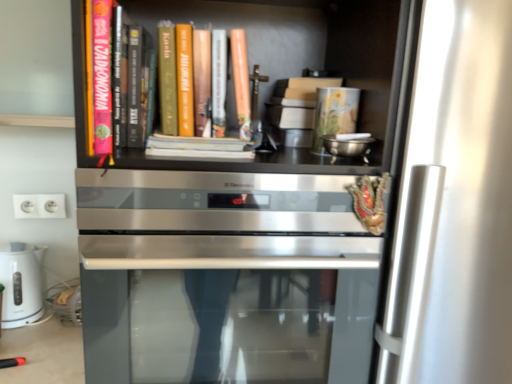
Measure the distance between point (9, 266) and camera.

The depth of point (9, 266) is 3.98 feet.

Describe the element at coordinates (224, 277) in the screenshot. I see `satin silver oven at center` at that location.

What is the approximate width of satin silver oven at center?

satin silver oven at center is 24.40 inches in width.

Find the location of a particular element. Image resolution: width=512 pixels, height=384 pixels. white plastic electrical outlet at lower left is located at coordinates (39, 205).

Find the location of a particular element. The image size is (512, 384). white glossy electric kettle at lower left is located at coordinates (21, 283).

From the image's perspective, is white plastic electrical outlet at lower left on white glossy electric kettle at lower left?

Yes, from the image's perspective, white plastic electrical outlet at lower left is on top of white glossy electric kettle at lower left.

Considering the relative sizes of white plastic electrical outlet at lower left and white glossy electric kettle at lower left in the image provided, is white plastic electrical outlet at lower left bigger than white glossy electric kettle at lower left?

Incorrect, white plastic electrical outlet at lower left is not larger than white glossy electric kettle at lower left.

In the image, there is a white plastic electrical outlet at lower left. Identify the location of home appliance below it (from a real-world perspective). (21, 283).

Which is farther, (25, 195) or (32, 246)?

Point (25, 195)

Is matte orange book at center, the 1th book from the right, surrounding pink matte book at upper left, which appears as the 2th book when viewed from the right?

That's incorrect, pink matte book at upper left, which appears as the 2th book when viewed from the right, is not inside matte orange book at center, the 1th book from the right.

Is matte orange book at center, positioned as the second book in left-to-right order, touching pink matte book at upper left, the 1th book viewed from the left?

No, matte orange book at center, positioned as the second book in left-to-right order, is not in contact with pink matte book at upper left, the 1th book viewed from the left.

Find the location of a particular element. The width and height of the screenshot is (512, 384). book behind the pink matte book at upper left, the 1th book viewed from the left is located at coordinates (218, 82).

Considering the sizes of objects matte orange book at center, the 1th book from the right, and pink matte book at upper left, which appears as the 2th book when viewed from the right, in the image provided, who is shorter, matte orange book at center, the 1th book from the right, or pink matte book at upper left, which appears as the 2th book when viewed from the right,?

With less height is matte orange book at center, the 1th book from the right.

From a real-world perspective, between pink matte book at upper left, the 1th book viewed from the left, and satin silver oven at center, who is vertically higher?

pink matte book at upper left, the 1th book viewed from the left, from a real-world perspective.

Which is nearer, (x=108, y=107) or (x=351, y=348)?

Point (x=108, y=107) is closer to the camera than point (x=351, y=348).

From the image's perspective, which object appears higher, pink matte book at upper left, which appears as the 2th book when viewed from the right, or satin silver oven at center?

pink matte book at upper left, which appears as the 2th book when viewed from the right, appears higher in the image.

From their relative heights in the image, would you say pink matte book at upper left, which appears as the 2th book when viewed from the right, is taller or shorter than satin silver oven at center?

In the image, pink matte book at upper left, which appears as the 2th book when viewed from the right, appears to be shorter than satin silver oven at center.

Considering the positions of objects satin silver oven at center and white plastic electrical outlet at lower left in the image provided, who is behind, satin silver oven at center or white plastic electrical outlet at lower left?

white plastic electrical outlet at lower left is further from the camera.

Is the surface of satin silver oven at center in direct contact with white plastic electrical outlet at lower left?

No, satin silver oven at center is not making contact with white plastic electrical outlet at lower left.

Does point (91, 349) lie behind point (33, 201)?

No, (91, 349) is closer to viewer.

Which point is more forward, (x=182, y=362) or (x=224, y=68)?

The point (x=224, y=68) is closer to the camera.

Between satin silver oven at center and matte orange book at center, the 1th book from the right, which one has smaller width?

matte orange book at center, the 1th book from the right, is thinner.

From a real-world perspective, which object rests below the other?

In real-world perspective, satin silver oven at center is lower.

Does matte orange book at center, the 1th book from the right, appear on the right side of satin silver oven at center?

No, matte orange book at center, the 1th book from the right, is not to the right of satin silver oven at center.

Is matte orange book at center, the 1th book from the right, taller than satin silver oven at center?

No.

Looking at this image, in terms of size, does matte orange book at center, the 1th book from the right, appear bigger or smaller than satin silver oven at center?

Clearly, matte orange book at center, the 1th book from the right, is smaller in size than satin silver oven at center.

You are a GUI agent. You are given a task and a screenshot of the screen. Output one action in this format:
    pyautogui.click(x=<x>, y=<y>)
    Task: Click on the home appliance on the left of satin silver oven at center
    
    Given the screenshot: What is the action you would take?
    pyautogui.click(x=21, y=283)

Consider the image. Is white glossy electric kettle at lower left positioned behind satin silver oven at center?

Yes, it is behind satin silver oven at center.

Considering the relative sizes of white glossy electric kettle at lower left and satin silver oven at center in the image provided, is white glossy electric kettle at lower left thinner than satin silver oven at center?

Indeed, white glossy electric kettle at lower left has a lesser width compared to satin silver oven at center.

How many degrees apart are the facing directions of white glossy electric kettle at lower left and satin silver oven at center?

white glossy electric kettle at lower left and satin silver oven at center are facing 0.319 degrees away from each other.

You are a GUI agent. You are given a task and a screenshot of the screen. Output one action in this format:
    pyautogui.click(x=<x>, y=<y>)
    Task: Click on the home appliance below the white plastic electrical outlet at lower left (from a real-world perspective)
    
    Given the screenshot: What is the action you would take?
    pyautogui.click(x=21, y=283)

The width and height of the screenshot is (512, 384). I want to click on book lying below the pink matte book at upper left, which appears as the 2th book when viewed from the right (from the image's perspective), so click(218, 82).

Based on their spatial positions, is pink matte book at upper left, the 1th book viewed from the left, or white plastic electrical outlet at lower left closer to matte orange book at center, positioned as the second book in left-to-right order?

Among the two, pink matte book at upper left, the 1th book viewed from the left, is located nearer to matte orange book at center, positioned as the second book in left-to-right order.

Considering their positions, is matte orange book at center, the 1th book from the right, positioned closer to satin silver oven at center than white plastic electrical outlet at lower left?

Among the two, matte orange book at center, the 1th book from the right, is located nearer to satin silver oven at center.

Estimate the real-world distances between objects in this image. Which object is closer to matte orange book at center, positioned as the second book in left-to-right order, white glossy electric kettle at lower left or white plastic electrical outlet at lower left?

white plastic electrical outlet at lower left lies closer to matte orange book at center, positioned as the second book in left-to-right order, than the other object.

Considering their positions, is matte orange book at center, the 1th book from the right, positioned closer to white glossy electric kettle at lower left than white plastic electrical outlet at lower left?

The object closer to white glossy electric kettle at lower left is white plastic electrical outlet at lower left.

When comparing their distances from white plastic electrical outlet at lower left, does pink matte book at upper left, which appears as the 2th book when viewed from the right, or satin silver oven at center seem further?

satin silver oven at center.

Based on their spatial positions, is satin silver oven at center or white plastic electrical outlet at lower left closer to matte orange book at center, the 1th book from the right?

Among the two, satin silver oven at center is located nearer to matte orange book at center, the 1th book from the right.

Considering their positions, is matte orange book at center, positioned as the second book in left-to-right order, positioned closer to white plastic electrical outlet at lower left than white glossy electric kettle at lower left?

white glossy electric kettle at lower left.

When comparing their distances from satin silver oven at center, does white plastic electrical outlet at lower left or pink matte book at upper left, which appears as the 2th book when viewed from the right, seem closer?

Among the two, pink matte book at upper left, which appears as the 2th book when viewed from the right, is located nearer to satin silver oven at center.

Locate an element on the screen. electric outlet between white glossy electric kettle at lower left and matte orange book at center, positioned as the second book in left-to-right order, in the horizontal direction is located at coordinates (39, 205).

This screenshot has height=384, width=512. I want to click on home appliance positioned between pink matte book at upper left, the 1th book viewed from the left, and white plastic electrical outlet at lower left from near to far, so click(21, 283).

Where is `book that lies between pink matte book at upper left, the 1th book viewed from the left, and satin silver oven at center from top to bottom`? This screenshot has width=512, height=384. book that lies between pink matte book at upper left, the 1th book viewed from the left, and satin silver oven at center from top to bottom is located at coordinates (218, 82).

Locate an element on the screen. This screenshot has height=384, width=512. book located between pink matte book at upper left, which appears as the 2th book when viewed from the right, and white plastic electrical outlet at lower left in the depth direction is located at coordinates (218, 82).